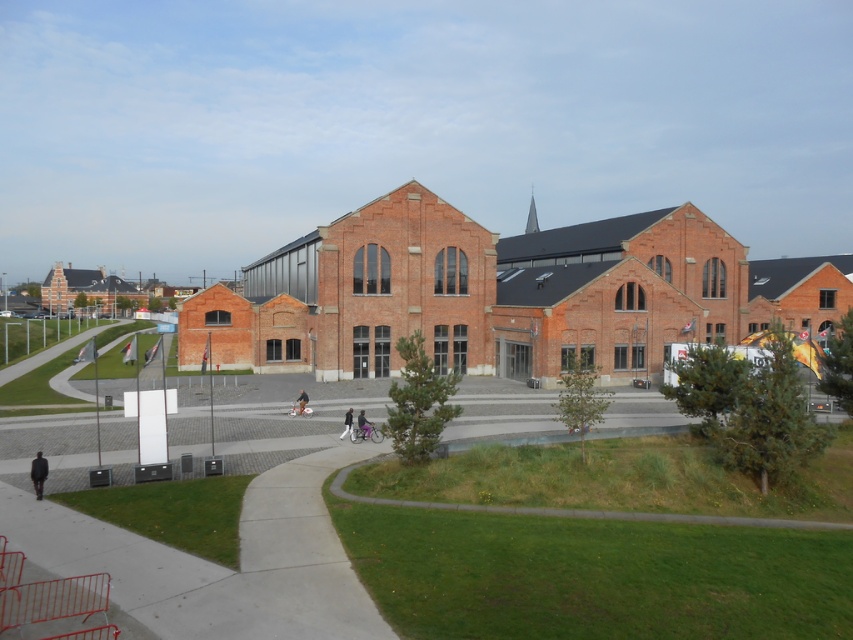
You are standing on the curved pathway leading to the historic brick building. You notice a black matte person at center and a dark gray fabric pants at center. Which object is closer to you?

The black matte person at center is positioned over dark gray fabric pants at center, meaning the black matte person at center is closer to you.

You are a photographer trying to capture the main building in the scene. You notice a black matte person at center and a dark gray fabric pants at center in the foreground. Which object should you adjust your focus to avoid blurring, considering their sizes?

The black matte person at center is wider than the dark gray fabric pants at center, so adjusting focus on the larger object would help maintain clarity in the photo.

You are planning to place a bench between the dark gray jacket at lower left and the dark blue jeans at center. What is the minimum length the bench should be to ensure it can fit between them?

The dark gray jacket at lower left and dark blue jeans at center are 13.35 meters apart, so the bench should be at least 13.35 meters long to fit between them.